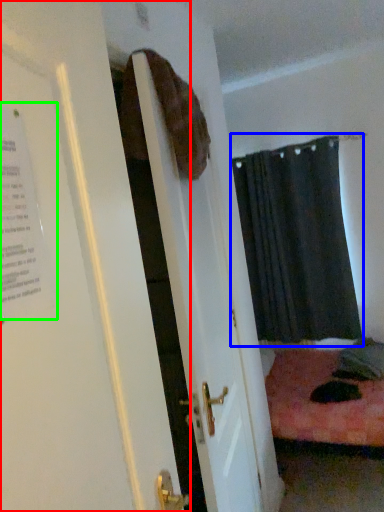
Question: Considering the real-world distances, which object is closest to door (highlighted by a red box)? curtain (highlighted by a blue box) or poster (highlighted by a green box).

Choices:
 (A) curtain
 (B) poster

Answer: (B)